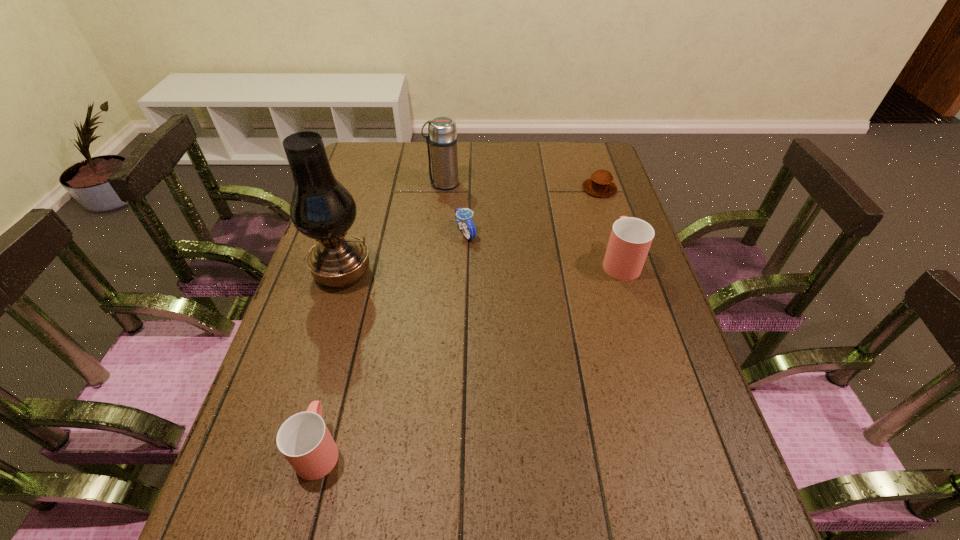
Locate an element on the screen. This screenshot has height=540, width=960. vacant space located 0.290m on the side of the shorter cup with the handle is located at coordinates (354, 309).

You are a GUI agent. You are given a task and a screenshot of the screen. Output one action in this format:
    pyautogui.click(x=<x>, y=<y>)
    Task: Click on the free space located 0.230m on the side of the taller cup with the handle
    Image resolution: width=960 pixels, height=540 pixels.
    Given the screenshot: What is the action you would take?
    pyautogui.click(x=599, y=196)

Where is `blank area located on the side of the taller cup with the handle`? blank area located on the side of the taller cup with the handle is located at coordinates (606, 217).

You are a GUI agent. You are given a task and a screenshot of the screen. Output one action in this format:
    pyautogui.click(x=<x>, y=<y>)
    Task: Click on the blank space located on the side of the taller cup with the handle
    Image resolution: width=960 pixels, height=540 pixels.
    Given the screenshot: What is the action you would take?
    pyautogui.click(x=598, y=192)

The height and width of the screenshot is (540, 960). In order to click on vacant area located on the right of the tallest object in this screenshot , I will do `click(402, 273)`.

Where is `vacant space located 0.090m with a handle on the side of the fifth shortest object`? Image resolution: width=960 pixels, height=540 pixels. vacant space located 0.090m with a handle on the side of the fifth shortest object is located at coordinates (399, 184).

Find the location of `free space located with a handle on the side of the fifth shortest object`. free space located with a handle on the side of the fifth shortest object is located at coordinates (372, 184).

Identify the location of free location located with a handle on the side of the fifth shortest object. The image size is (960, 540). (376, 184).

Where is `vacant space situated on the left of the muffin`? vacant space situated on the left of the muffin is located at coordinates (492, 188).

The height and width of the screenshot is (540, 960). What are the coordinates of `free space located on the back of the watch` in the screenshot? It's located at (468, 152).